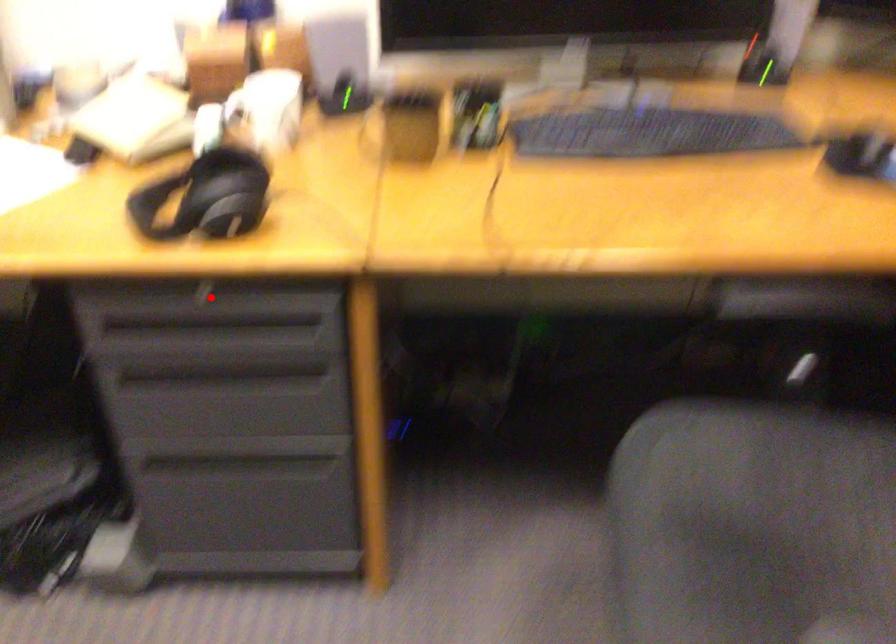
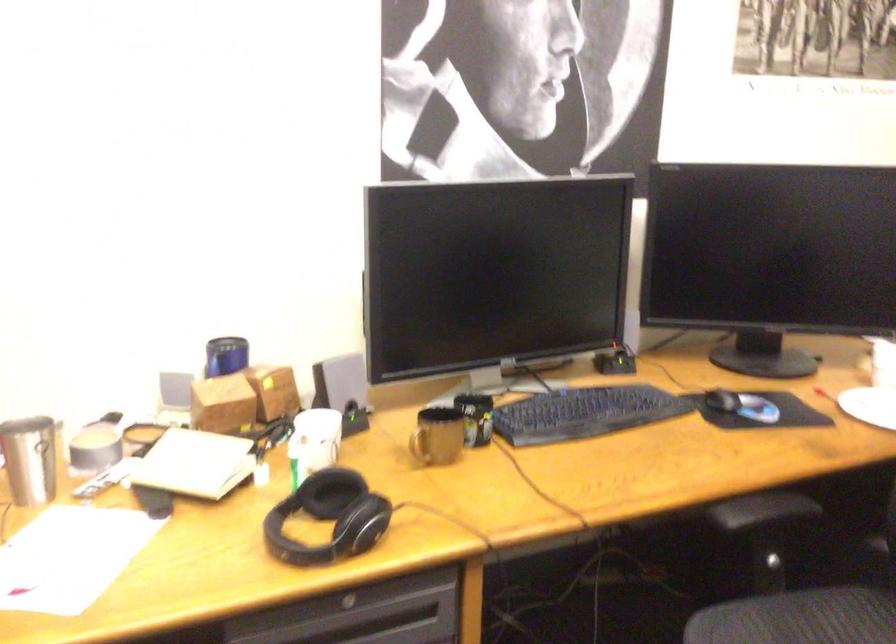
Question: I am providing you with two images of the same scene from different viewpoints. Given a red point in image1, look at the same physical point in image2. Is it:

Choices:
 (A) Closer to the viewpoint
 (B) Farther from the viewpoint

Answer: (B)